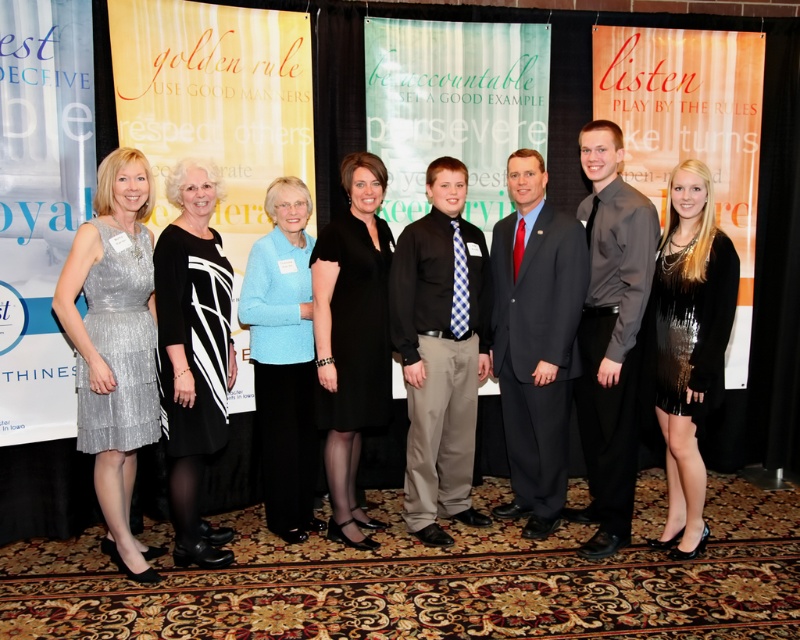
Who is more forward, (508, 257) or (720, 323)?

Positioned in front is point (720, 323).

Is dark gray suit at center in front of black sequined dress at center?

No, it is not.

Describe the element at coordinates (536, 340) in the screenshot. I see `dark gray suit at center` at that location.

At what (x,y) coordinates should I click in order to perform the action: click on dark gray suit at center. Please return your answer as a coordinate pair (x, y). Image resolution: width=800 pixels, height=640 pixels. Looking at the image, I should click on (536, 340).

Which is above, black cotton shirt at center or black sequined dress at center?

black cotton shirt at center is higher up.

Looking at this image, measure the distance from black cotton shirt at center to black sequined dress at center.

black cotton shirt at center and black sequined dress at center are 89.94 centimeters apart from each other.

Image resolution: width=800 pixels, height=640 pixels. I want to click on black cotton shirt at center, so pos(440,349).

Identify the location of black cotton shirt at center. (440, 349).

Which is behind, point (188, 259) or point (390, 358)?

Positioned behind is point (390, 358).

Who is positioned more to the left, black and white dress at center or black satin dress at center?

From the viewer's perspective, black and white dress at center appears more on the left side.

Is point (202, 369) in front of point (328, 339)?

Yes, it is in front of point (328, 339).

Locate an element on the screen. This screenshot has height=640, width=800. black and white dress at center is located at coordinates [193, 353].